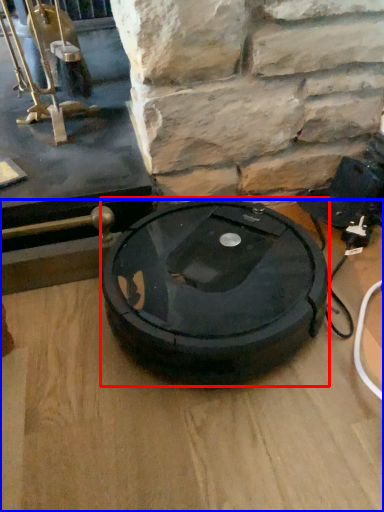
Question: Which point is further to the camera, car tire (highlighted by a red box) or table top (highlighted by a blue box)?

Choices:
 (A) car tire
 (B) table top

Answer: (A)